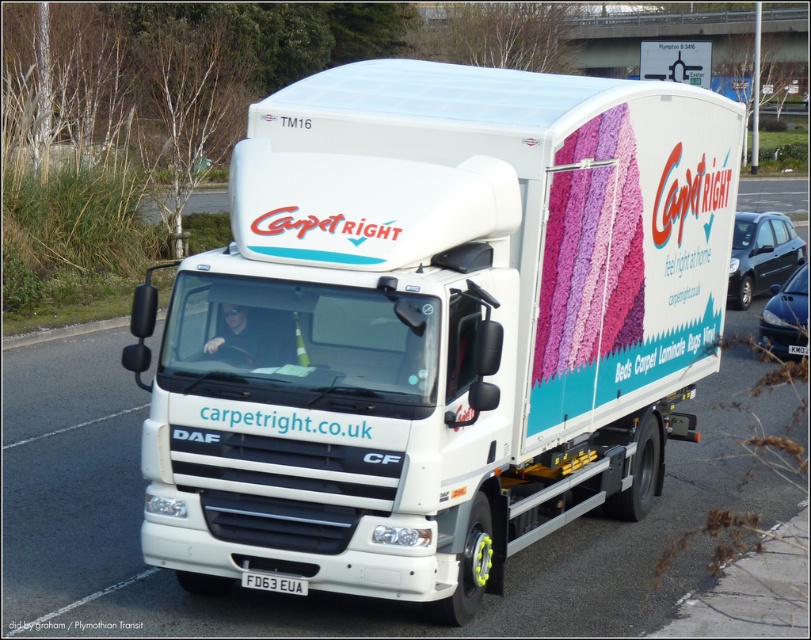
Question: Can you confirm if metallic blue car at right is positioned to the left of black plastic license plate at center?

Choices:
 (A) no
 (B) yes

Answer: (A)

Question: Does white matte trailer truck at center have a larger size compared to metallic blue sedan at right?

Choices:
 (A) no
 (B) yes

Answer: (A)

Question: Does metallic blue car at right appear on the left side of white plastic license plate at center?

Choices:
 (A) no
 (B) yes

Answer: (A)

Question: Which point is closer to the camera taking this photo?

Choices:
 (A) (148, 554)
 (B) (805, 323)

Answer: (A)

Question: Which point appears closest to the camera in this image?

Choices:
 (A) (777, 342)
 (B) (794, 346)
 (C) (434, 342)
 (D) (250, 588)

Answer: (C)

Question: Which of the following is the farthest from the observer?

Choices:
 (A) black plastic license plate at center
 (B) white matte trailer truck at center
 (C) white plastic license plate at center
 (D) metallic blue car at right

Answer: (C)